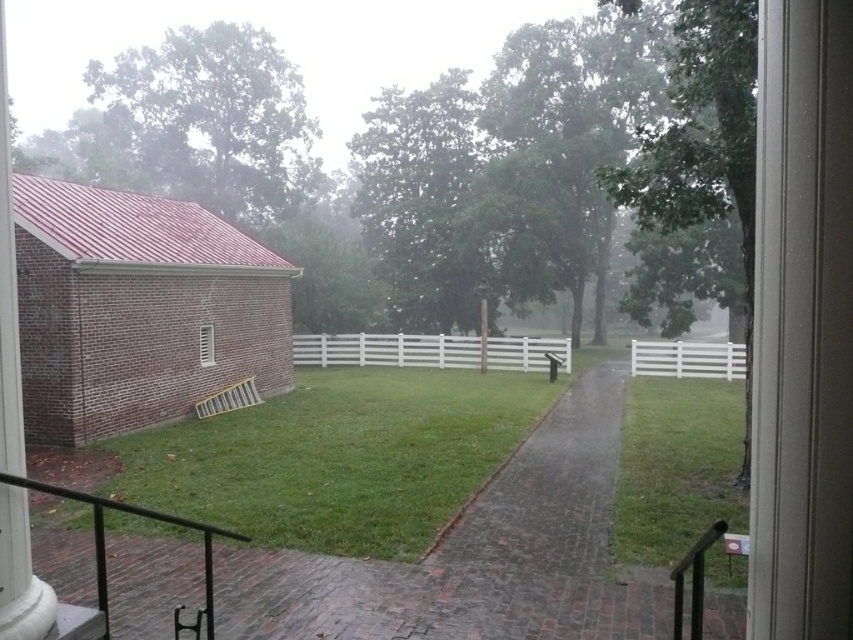
Between green grass at center and brick paved path at center, which one appears on the left side from the viewer's perspective?

From the viewer's perspective, green grass at center appears more on the left side.

Does green grass at center appear under brick paved path at center?

Incorrect, green grass at center is not positioned below brick paved path at center.

Who is more forward, (x=250, y=481) or (x=512, y=474)?

Positioned in front is point (x=250, y=481).

You are a GUI agent. You are given a task and a screenshot of the screen. Output one action in this format:
    pyautogui.click(x=<x>, y=<y>)
    Task: Click on the green grass at center
    The image size is (853, 640).
    Given the screenshot: What is the action you would take?
    pyautogui.click(x=337, y=458)

Is green grass at center in front of white painted wood window at lower left?

Yes, it is in front of white painted wood window at lower left.

Who is lower down, green grass at center or white painted wood window at lower left?

Positioned lower is green grass at center.

Where is `green grass at center`? green grass at center is located at coordinates (337, 458).

Does brick paved path at center have a greater height compared to white painted wood window at lower left?

In fact, brick paved path at center may be shorter than white painted wood window at lower left.

Is brick paved path at center to the left of white painted wood window at lower left from the viewer's perspective?

Incorrect, brick paved path at center is not on the left side of white painted wood window at lower left.

Describe the element at coordinates (537, 534) in the screenshot. I see `brick paved path at center` at that location.

This screenshot has height=640, width=853. Identify the location of brick paved path at center. (537, 534).